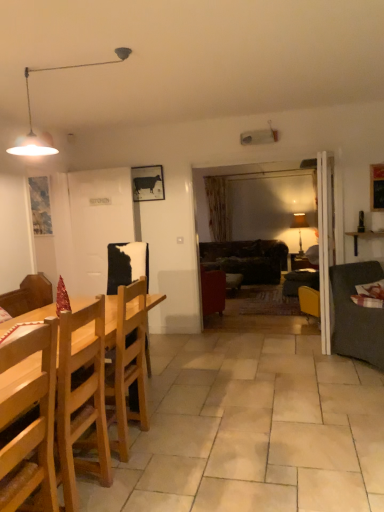
Locate an element on the screen. matte black lamp at right, which is counted as the second lamp, starting from the left is located at coordinates (299, 226).

The width and height of the screenshot is (384, 512). I want to click on light wood chair at left, positioned as the 1th chair in front-to-back order, so click(x=81, y=397).

The image size is (384, 512). What do you see at coordinates (40, 205) in the screenshot?
I see `wooden picture frame at left, the 2th picture frame positioned from the front` at bounding box center [40, 205].

Where is `metallic pendant light at upper left, the first lamp in the top-to-bottom sequence`? The width and height of the screenshot is (384, 512). metallic pendant light at upper left, the first lamp in the top-to-bottom sequence is located at coordinates (31, 115).

This screenshot has width=384, height=512. Find the location of `light brown wooden chair at left, the first chair when ordered from back to front`. light brown wooden chair at left, the first chair when ordered from back to front is located at coordinates point(128,364).

Looking at the image, does wooden picture frame at left, the 2th picture frame positioned from the front, seem bigger or smaller compared to dark gray fabric couch at right, which appears as the second studio couch when viewed from the back?

wooden picture frame at left, the 2th picture frame positioned from the front, is smaller than dark gray fabric couch at right, which appears as the second studio couch when viewed from the back.

From the image's perspective, which one is positioned lower, wooden picture frame at left, the 2th picture frame positioned from the front, or dark gray fabric couch at right, which appears as the second studio couch when viewed from the back?

dark gray fabric couch at right, which appears as the second studio couch when viewed from the back.

Between wooden picture frame at left, the 1th picture frame viewed from the left, and dark gray fabric couch at right, the first studio couch from the front, which one has larger width?

dark gray fabric couch at right, the first studio couch from the front, is wider.

Considering the relative positions of metallic cow print at upper center, the 2th picture frame positioned from the back, and dark gray fabric couch at right, the first studio couch from the front, in the image provided, is metallic cow print at upper center, the 2th picture frame positioned from the back, in front of dark gray fabric couch at right, the first studio couch from the front,?

No.

Is metallic cow print at upper center, the 2th picture frame positioned from the back, turned away from dark gray fabric couch at right, which appears as the second studio couch when viewed from the back?

No, metallic cow print at upper center, the 2th picture frame positioned from the back, is not facing away from dark gray fabric couch at right, which appears as the second studio couch when viewed from the back.

Does point (152, 169) lie in front of point (358, 309)?

No, it is not.

Is dark brown leather couch at center, which is counted as the 1th studio couch, starting from the back, next to matte black lamp at right, which appears as the 1th lamp when viewed from the back?

No, dark brown leather couch at center, which is counted as the 1th studio couch, starting from the back, is not beside matte black lamp at right, which appears as the 1th lamp when viewed from the back.

Which is in front, dark brown leather couch at center, which is counted as the 1th studio couch, starting from the back, or matte black lamp at right, which appears as the 1th lamp when viewed from the back?

dark brown leather couch at center, which is counted as the 1th studio couch, starting from the back, is in front.

From the picture: From a real-world perspective, between dark brown leather couch at center, the 2th studio couch from the front, and matte black lamp at right, marked as the 1th lamp in a bottom-to-top arrangement, who is vertically lower?

In real-world perspective, dark brown leather couch at center, the 2th studio couch from the front, is lower.

Looking at the image, does dark brown leather couch at center, which is counted as the 1th studio couch, starting from the back, seem bigger or smaller compared to metallic pendant light at upper left, placed as the 2th lamp when sorted from bottom to top?

Clearly, dark brown leather couch at center, which is counted as the 1th studio couch, starting from the back, is larger in size than metallic pendant light at upper left, placed as the 2th lamp when sorted from bottom to top.

How many degrees apart are the facing directions of dark brown leather couch at center, which is counted as the 1th studio couch, starting from the back, and metallic pendant light at upper left, which is counted as the 1th lamp, starting from the front?

dark brown leather couch at center, which is counted as the 1th studio couch, starting from the back, and metallic pendant light at upper left, which is counted as the 1th lamp, starting from the front, are facing 4.06 degrees away from each other.

Does dark brown leather couch at center, the 2th studio couch from the front, have a lesser height compared to metallic pendant light at upper left, the first lamp viewed from the left?

In fact, dark brown leather couch at center, the 2th studio couch from the front, may be taller than metallic pendant light at upper left, the first lamp viewed from the left.

Is dark brown leather couch at center, the 2th studio couch from the front, facing away from metallic pendant light at upper left, the first lamp viewed from the left?

No, dark brown leather couch at center, the 2th studio couch from the front, is not facing the opposite direction of metallic pendant light at upper left, the first lamp viewed from the left.

Considering the relative positions of light wood chair at left, which is the second chair from back to front, and metallic pendant light at upper left, placed as the 2th lamp when sorted from bottom to top, in the image provided, is light wood chair at left, which is the second chair from back to front, to the left or to the right of metallic pendant light at upper left, placed as the 2th lamp when sorted from bottom to top,?

From the image, it's evident that light wood chair at left, which is the second chair from back to front, is to the right of metallic pendant light at upper left, placed as the 2th lamp when sorted from bottom to top.

Is light wood chair at left, which is the second chair from back to front, taller than metallic pendant light at upper left, which ranks as the 2th lamp in right-to-left order?

Yes.

From a real-world perspective, is light wood chair at left, which is the second chair from back to front, physically below metallic pendant light at upper left, which is counted as the 1th lamp, starting from the front?

Yes, from a real-world perspective, light wood chair at left, which is the second chair from back to front, is below metallic pendant light at upper left, which is counted as the 1th lamp, starting from the front.

Considering the positions of objects light wood chair at left, positioned as the 1th chair in front-to-back order, and metallic pendant light at upper left, arranged as the second lamp when viewed from the back, in the image provided, who is in front, light wood chair at left, positioned as the 1th chair in front-to-back order, or metallic pendant light at upper left, arranged as the second lamp when viewed from the back,?

light wood chair at left, positioned as the 1th chair in front-to-back order, is closer to the camera.

From the image's perspective, is light wood chair at left, which is the second chair from back to front, located above dark gray fabric couch at right, the first studio couch from the front?

No, from the image's perspective, light wood chair at left, which is the second chair from back to front, is not over dark gray fabric couch at right, the first studio couch from the front.

From the image's perspective, which chair is the 2nd one below the dark gray fabric couch at right, which appears as the second studio couch when viewed from the back? Please provide its 2D coordinates.

[(81, 397)]

Which is more to the left, light wood chair at left, which is the second chair from back to front, or dark gray fabric couch at right, the first studio couch from the front?

light wood chair at left, which is the second chair from back to front, is more to the left.

Considering the sizes of objects metallic pendant light at upper left, which ranks as the 2th lamp in right-to-left order, and light brown wooden chair at left, which ranks as the 2th chair in front-to-back order, in the image provided, who is bigger, metallic pendant light at upper left, which ranks as the 2th lamp in right-to-left order, or light brown wooden chair at left, which ranks as the 2th chair in front-to-back order,?

light brown wooden chair at left, which ranks as the 2th chair in front-to-back order, is bigger.

Between point (55, 152) and point (119, 374), which one is positioned behind?

The point (55, 152) is more distant.

Considering the sizes of metallic pendant light at upper left, arranged as the second lamp when viewed from the back, and light brown wooden chair at left, the first chair when ordered from back to front, in the image, is metallic pendant light at upper left, arranged as the second lamp when viewed from the back, wider or thinner than light brown wooden chair at left, the first chair when ordered from back to front,?

Clearly, metallic pendant light at upper left, arranged as the second lamp when viewed from the back, has less width compared to light brown wooden chair at left, the first chair when ordered from back to front.

Which picture frame is the 2nd one when counting from the back of the dark gray fabric couch at right, which appears as the second studio couch when viewed from the back? Please provide its 2D coordinates.

[(40, 205)]

Which studio couch is the 2nd one when counting from the right side of the metallic cow print at upper center, which is the first picture frame from front to back? Please provide its 2D coordinates.

[(356, 314)]

Considering their positions, is wooden picture frame at left, the 2th picture frame positioned from the front, positioned closer to dark brown leather couch at center, the 2th studio couch from the front, than wooden shelf at right?

wooden shelf at right is closer to dark brown leather couch at center, the 2th studio couch from the front.

When comparing their distances from metallic cow print at upper center, the 1th picture frame positioned from the right, does dark gray fabric couch at right, the first studio couch from the front, or wooden shelf at right seem closer?

wooden shelf at right.

Estimate the real-world distances between objects in this image. Which object is further from matte black lamp at right, marked as the 1th lamp in a bottom-to-top arrangement, metallic pendant light at upper left, which is counted as the 1th lamp, starting from the front, or light wood chair at left, which is the second chair from back to front?

light wood chair at left, which is the second chair from back to front, is positioned further to the anchor matte black lamp at right, marked as the 1th lamp in a bottom-to-top arrangement.

Which object lies nearer to the anchor point wooden picture frame at left, marked as the 1th picture frame in a back-to-front arrangement, dark brown leather couch at center, the 2th studio couch from the front, or light brown wooden chair at left, the first chair when ordered from back to front?

The object closer to wooden picture frame at left, marked as the 1th picture frame in a back-to-front arrangement, is dark brown leather couch at center, the 2th studio couch from the front.

When comparing their distances from dark brown leather couch at center, which is counted as the 1th studio couch, starting from the back, does wooden shelf at right or wooden picture frame at left, the 2th picture frame positioned from the front, seem closer?

The object closer to dark brown leather couch at center, which is counted as the 1th studio couch, starting from the back, is wooden shelf at right.

Which object lies nearer to the anchor point metallic cow print at upper center, which is the first picture frame from front to back, matte black lamp at right, marked as the 1th lamp in a bottom-to-top arrangement, or light wood chair at left, which is the second chair from back to front?

matte black lamp at right, marked as the 1th lamp in a bottom-to-top arrangement, is positioned closer to the anchor metallic cow print at upper center, which is the first picture frame from front to back.

Looking at the image, which one is located closer to wooden picture frame at left, the 2th picture frame positioned from the front, dark brown leather couch at center, the 2th studio couch from the front, or dark gray fabric couch at right, the first studio couch from the front?

dark brown leather couch at center, the 2th studio couch from the front, lies closer to wooden picture frame at left, the 2th picture frame positioned from the front, than the other object.

When comparing their distances from light brown wooden chair at left, the first chair when ordered from back to front, does dark gray fabric couch at right, the first studio couch from the front, or wooden picture frame at left, positioned as the 2th picture frame in right-to-left order, seem further?

wooden picture frame at left, positioned as the 2th picture frame in right-to-left order, is further to light brown wooden chair at left, the first chair when ordered from back to front.

The height and width of the screenshot is (512, 384). I want to click on cabinetry between metallic pendant light at upper left, which is counted as the 1th lamp, starting from the front, and dark brown leather couch at center, which is counted as the 1th studio couch, starting from the back, along the z-axis, so click(x=364, y=237).

Where is `cabinetry located between light brown wooden chair at left, which ranks as the 2th chair in front-to-back order, and dark brown leather couch at center, which is counted as the 1th studio couch, starting from the back, in the depth direction`? This screenshot has width=384, height=512. cabinetry located between light brown wooden chair at left, which ranks as the 2th chair in front-to-back order, and dark brown leather couch at center, which is counted as the 1th studio couch, starting from the back, in the depth direction is located at coordinates click(364, 237).

Locate an element on the screen. This screenshot has width=384, height=512. picture frame situated between light brown wooden chair at left, which ranks as the 2th chair in front-to-back order, and dark gray fabric couch at right, the first studio couch from the front, from left to right is located at coordinates (148, 183).

What are the coordinates of `lamp between light wood chair at left, positioned as the 1th chair in front-to-back order, and wooden picture frame at left, marked as the 1th picture frame in a back-to-front arrangement, from front to back` in the screenshot? It's located at (31, 115).